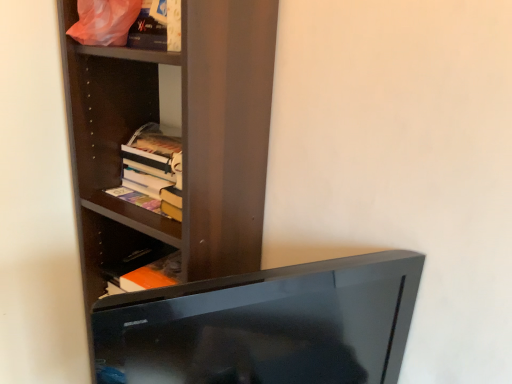
Question: Considering the positions of black glossy tv at lower center and hardcover books at center-left in the image, is black glossy tv at lower center taller or shorter than hardcover books at center-left?

Choices:
 (A) tall
 (B) short

Answer: (A)

Question: Choose the correct answer: Is black glossy tv at lower center inside hardcover books at center-left or outside it?

Choices:
 (A) outside
 (B) inside

Answer: (A)

Question: Estimate the real-world distances between objects in this image. Which object is farther from the black glossy tv at lower center?

Choices:
 (A) hardcover books at center-left
 (B) dark wood shelf at upper left
 (C) matte plastic bag at upper left

Answer: (C)

Question: Which of these objects is positioned closest to the dark wood shelf at upper left?

Choices:
 (A) black glossy tv at lower center
 (B) matte plastic bag at upper left
 (C) hardcover books at center-left

Answer: (C)